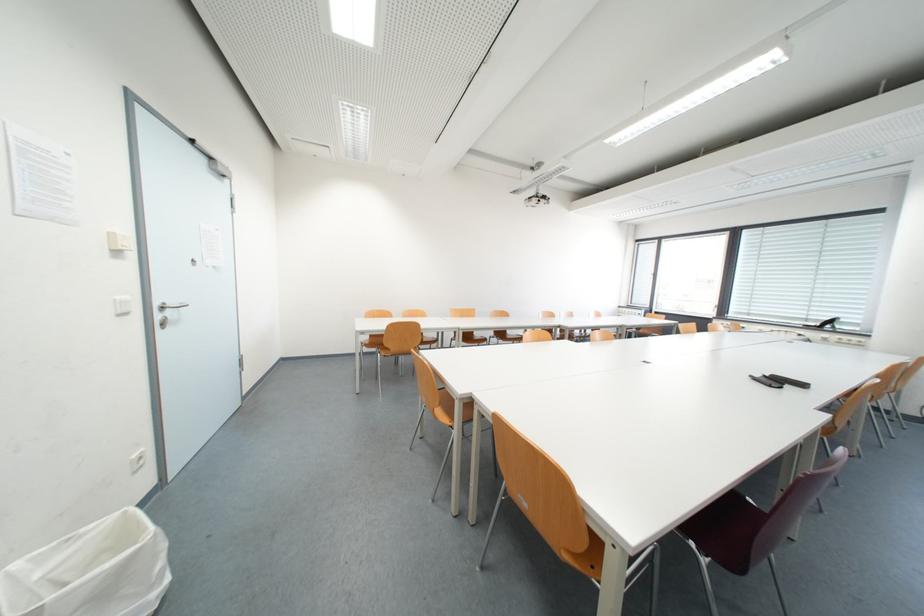
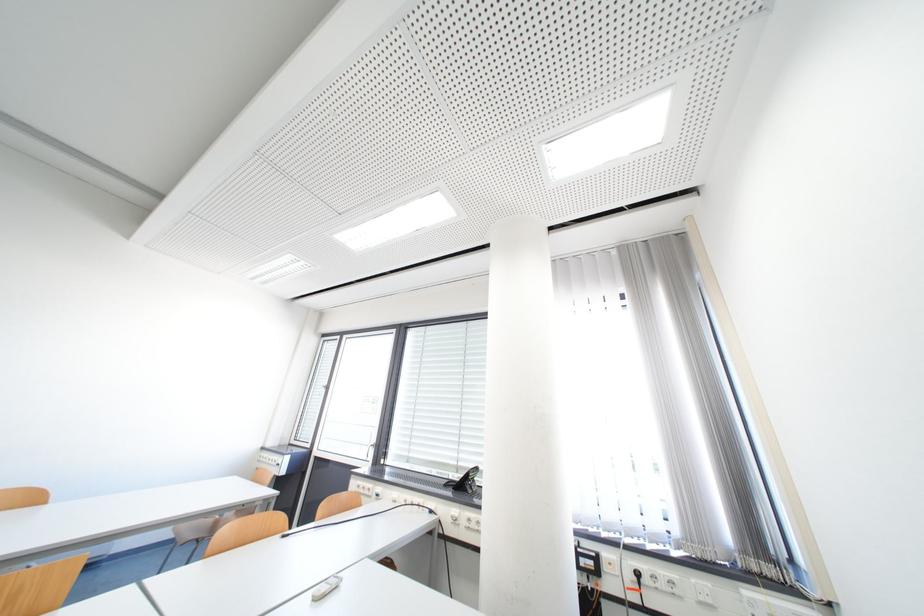
Locate, in the second image, the point that corresponds to [817,321] in the first image.

(468, 469)